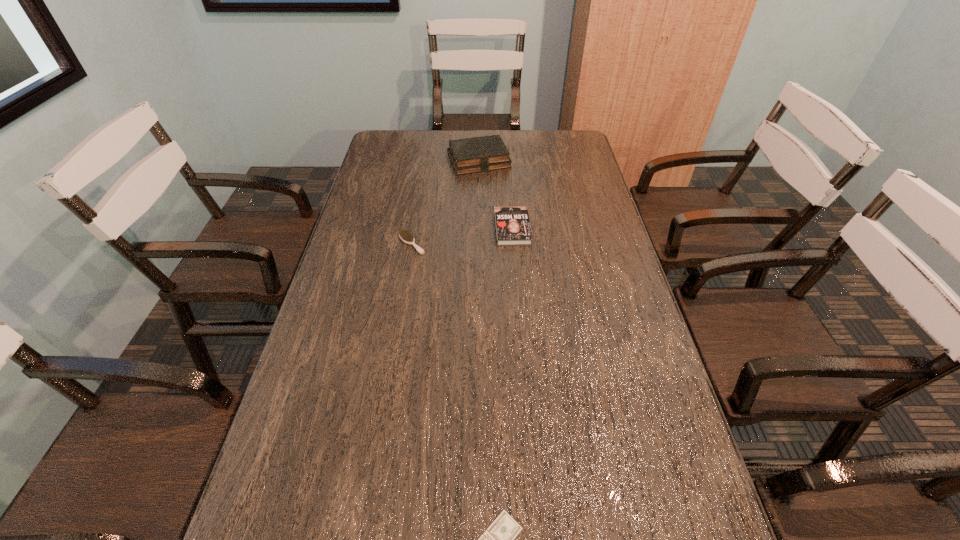
At what (x,y) coordinates should I click in order to perform the action: click on free location that satisfies the following two spatial constraints: 1. on the front side of the tallest object; 2. on the right side of the nearer book. Please return your answer as a coordinate pair (x, y). The image size is (960, 540). Looking at the image, I should click on (479, 228).